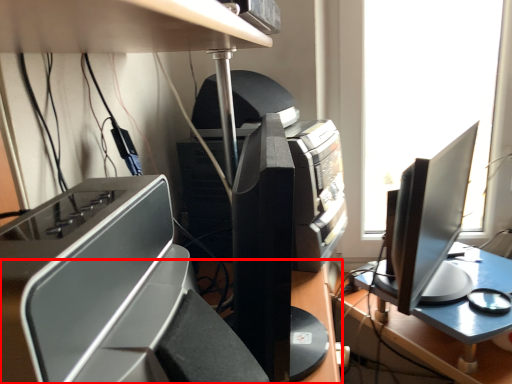
Question: Observing the image, what is the correct spatial positioning of desk (annotated by the red box) in reference to printer?

Choices:
 (A) left
 (B) right

Answer: (A)